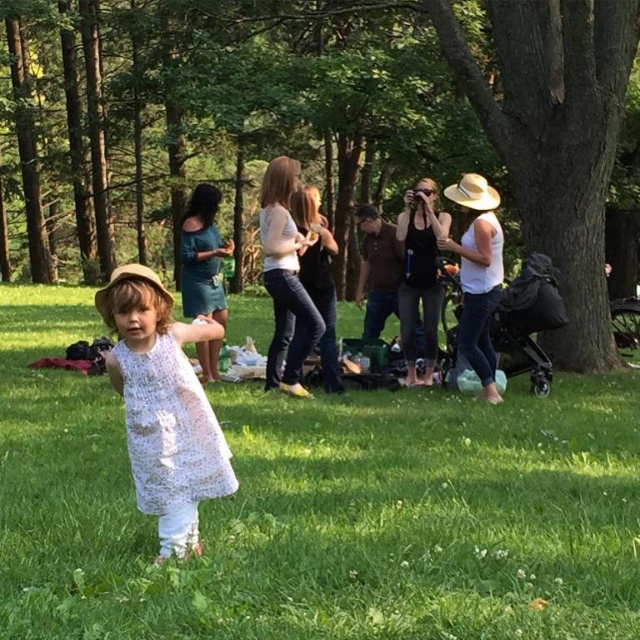
Question: Is white lace dress at center closer to the viewer compared to white matte tank top at center-right?

Choices:
 (A) no
 (B) yes

Answer: (B)

Question: Which object appears farthest from the camera in this image?

Choices:
 (A) white lace dress at center
 (B) black tank top at center

Answer: (B)

Question: Which is farther from the white lace dress at center?

Choices:
 (A) black tank top at center
 (B) white matte tank top at center-right

Answer: (A)

Question: In this image, where is white lace dress at center located relative to white matte tank top at center-right?

Choices:
 (A) below
 (B) above

Answer: (A)

Question: Which point is farther to the camera?

Choices:
 (A) (140, 490)
 (B) (413, 202)

Answer: (B)

Question: Does white lace dress at center have a lesser width compared to white matte tank top at center-right?

Choices:
 (A) yes
 (B) no

Answer: (A)